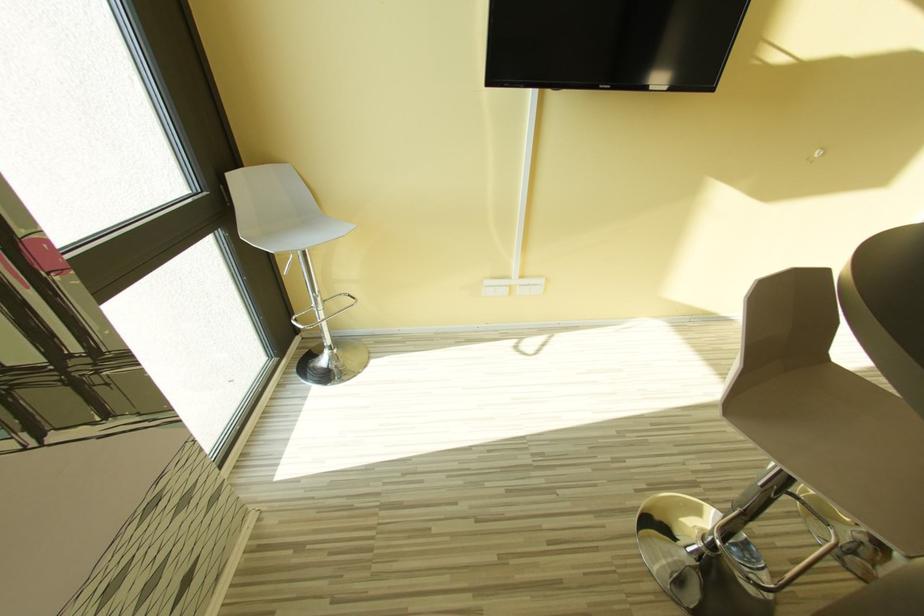
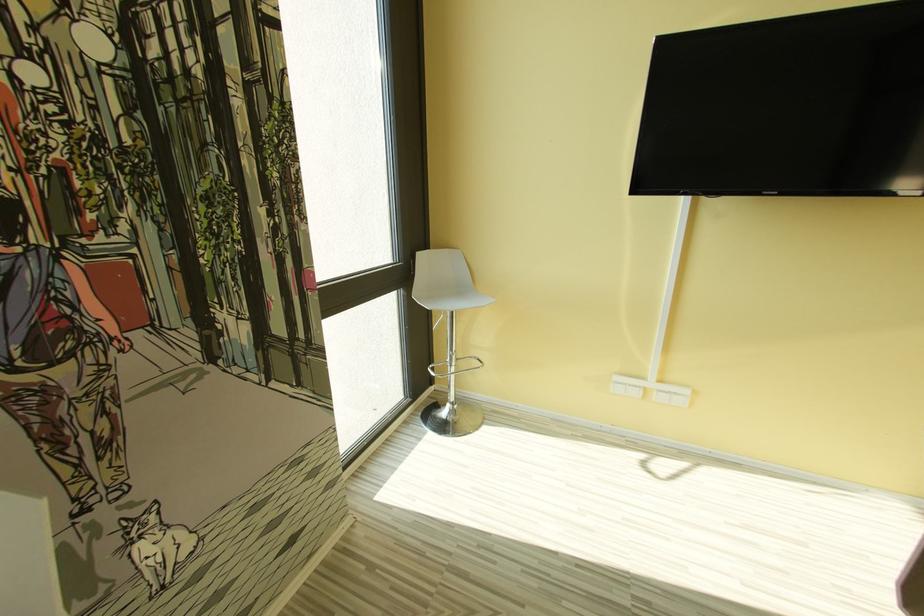
Question: The camera is either moving clockwise (left) or counter-clockwise (right) around the object. The first image is from the beginning of the video and the second image is from the end. Is the camera moving left or right when shooting the video?

Choices:
 (A) Left
 (B) Right

Answer: (B)